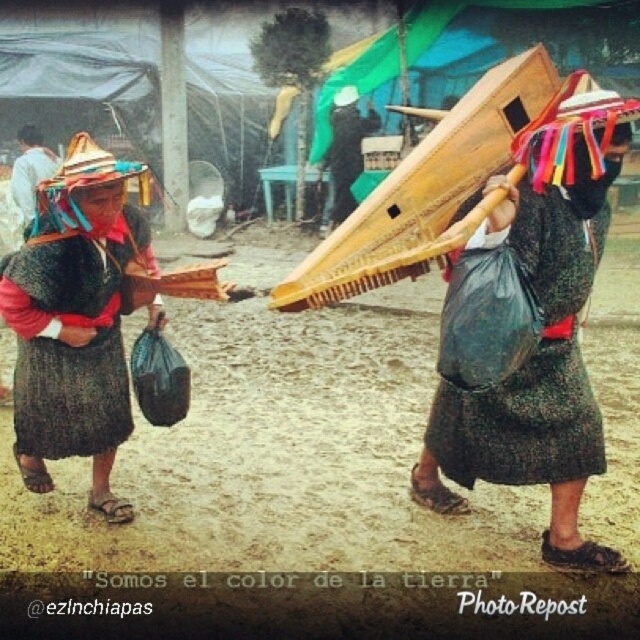
Question: Which of the following is the closest to the observer?

Choices:
 (A) matte black shawl at left
 (B) dark gray woven skirt at left

Answer: (A)

Question: Among these objects, which one is nearest to the camera?

Choices:
 (A) dark gray woven skirt at left
 (B) matte black shawl at left

Answer: (B)

Question: Where is matte black shawl at left located in relation to black textured dress at center in the image?

Choices:
 (A) right
 (B) left

Answer: (B)

Question: Which point is farther to the camera?

Choices:
 (A) (102, 390)
 (B) (529, 241)
 (C) (88, 449)

Answer: (A)

Question: Is matte black shawl at left below dark gray woven skirt at left?

Choices:
 (A) no
 (B) yes

Answer: (A)

Question: Can you confirm if matte black shawl at left is thinner than dark gray woven skirt at left?

Choices:
 (A) no
 (B) yes

Answer: (A)